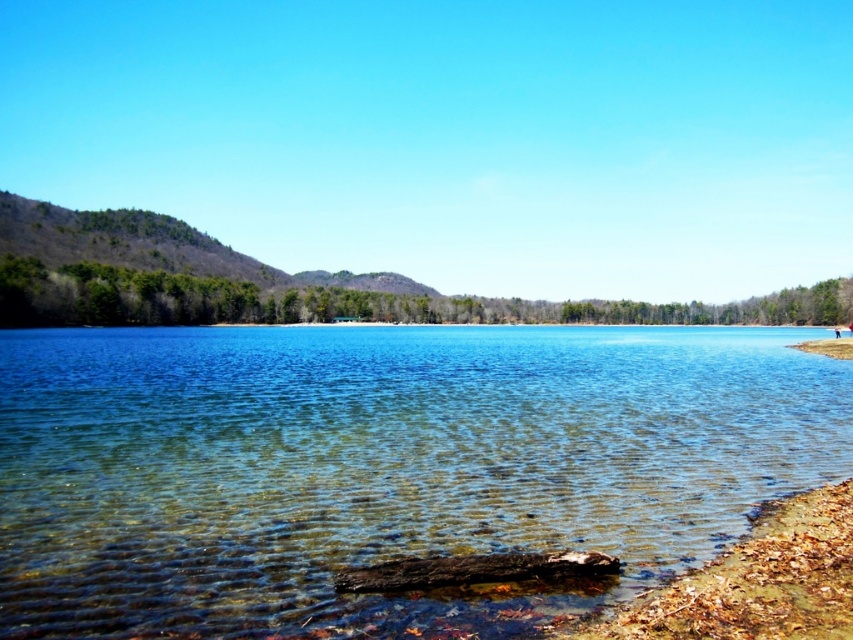
Measure the distance between point [708,588] and camera.

The distance of point [708,588] from camera is 9.42 meters.

Can you confirm if brown leafy shore at lower right is positioned below brown dirt shoreline at lower right?

Correct, brown leafy shore at lower right is located below brown dirt shoreline at lower right.

What do you see at coordinates (757, 580) in the screenshot?
I see `brown leafy shore at lower right` at bounding box center [757, 580].

Locate an element on the screen. This screenshot has width=853, height=640. brown leafy shore at lower right is located at coordinates (757, 580).

Is clear water at center above brown leafy shore at lower right?

Indeed, clear water at center is positioned over brown leafy shore at lower right.

Can you confirm if clear water at center is thinner than brown leafy shore at lower right?

No, clear water at center is not thinner than brown leafy shore at lower right.

Identify the location of clear water at center. The height and width of the screenshot is (640, 853). (381, 465).

Identify the location of clear water at center. (381, 465).

Which is in front, point (321, 628) or point (840, 346)?

Point (321, 628) is in front.

Can you confirm if clear water at center is taller than brown dirt shoreline at lower right?

Yes.

The image size is (853, 640). Describe the element at coordinates (381, 465) in the screenshot. I see `clear water at center` at that location.

At what (x,y) coordinates should I click in order to perform the action: click on clear water at center. Please return your answer as a coordinate pair (x, y). Looking at the image, I should click on (381, 465).